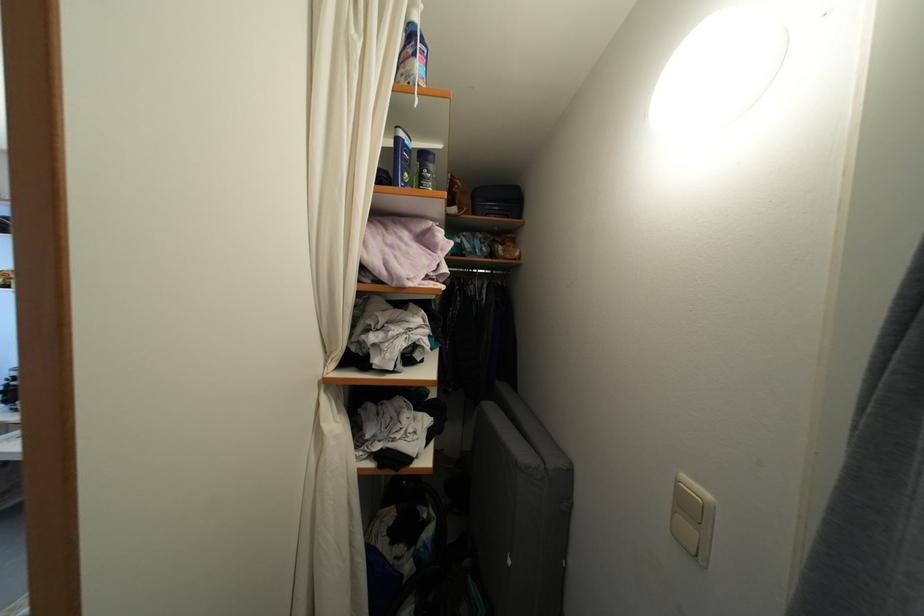
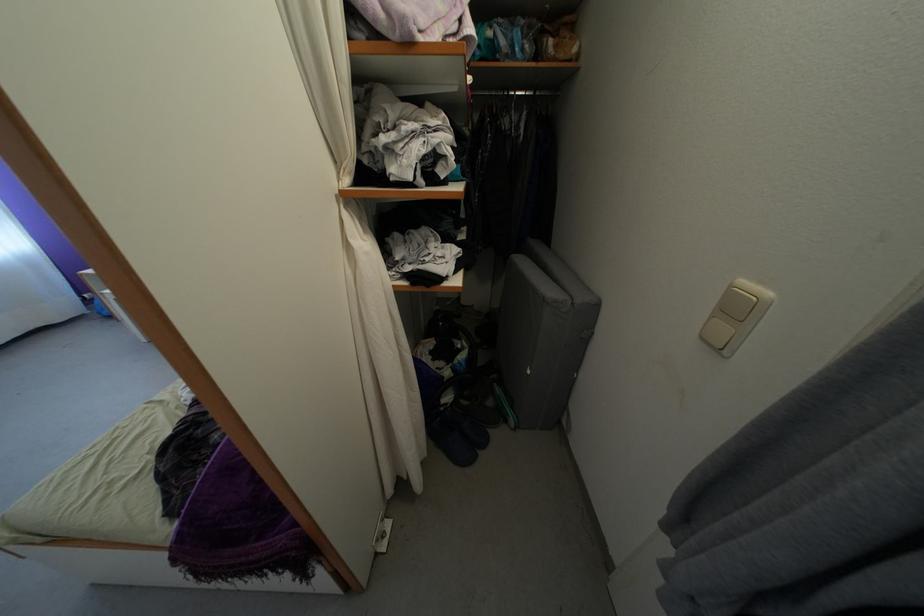
Locate, in the second image, the point that corresponds to [697,515] in the first image.

(743, 315)